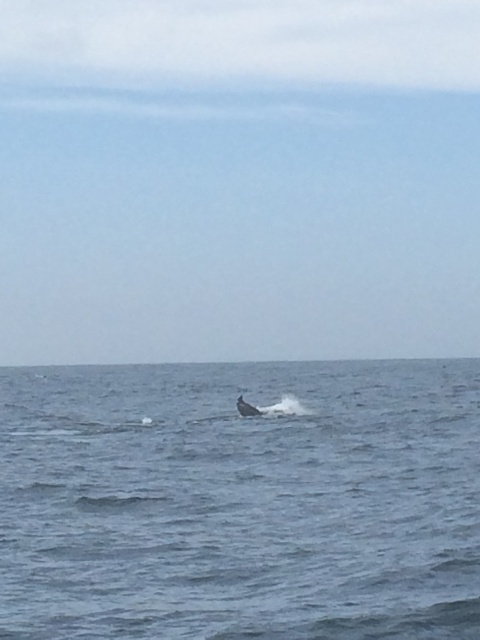
You are a marine biologist observing the ocean scene. You notice the blue water at center and the gray matte humpback whale at center. Which object appears taller in the image?

The blue water at center is taller than the gray matte humpback whale at center.

You are standing on a boat observing the blue water at center and the gray matte humpback whale at center. Which object is closer to you?

The blue water at center is closer to the viewer than the gray matte humpback whale at center.

You are a marine biologist observing the ocean scene. You notice the blue water at center and the gray matte humpback whale at center. Which object occupies a larger area in the image?

The blue water at center is bigger than the gray matte humpback whale at center, so the blue water at center occupies a larger area in the image.